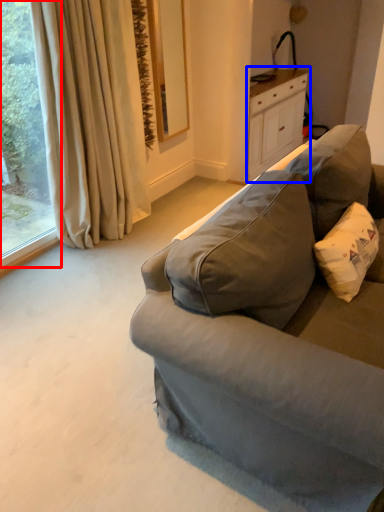
Question: Which of the following is the farthest to the observer, window (highlighted by a red box) or cabinetry (highlighted by a blue box)?

Choices:
 (A) window
 (B) cabinetry

Answer: (B)